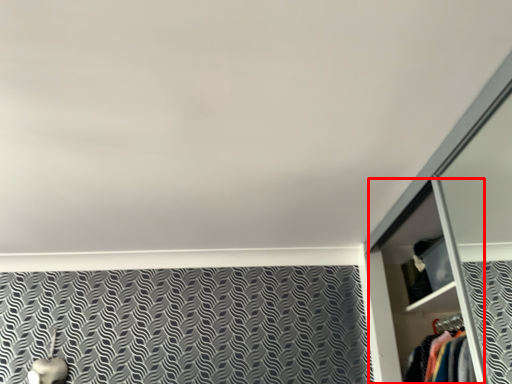
Question: From the image's perspective, where is dresser (annotated by the red box) located relative to cabinet?

Choices:
 (A) below
 (B) above

Answer: (A)